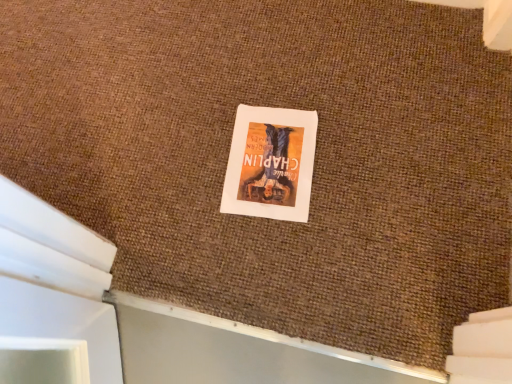
The image size is (512, 384). Find the location of `vacant space situated on the left part of matte paper poster at center`. vacant space situated on the left part of matte paper poster at center is located at coordinates (180, 175).